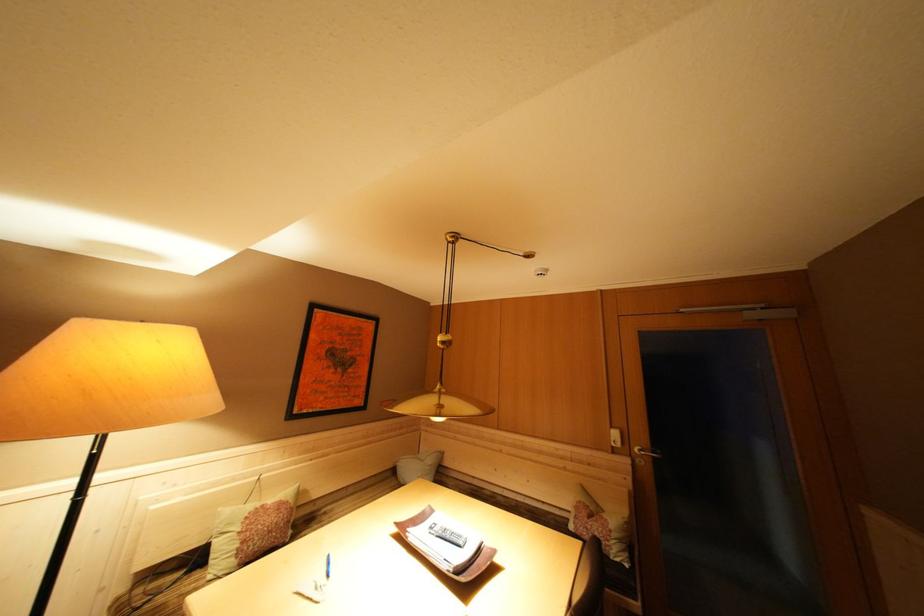
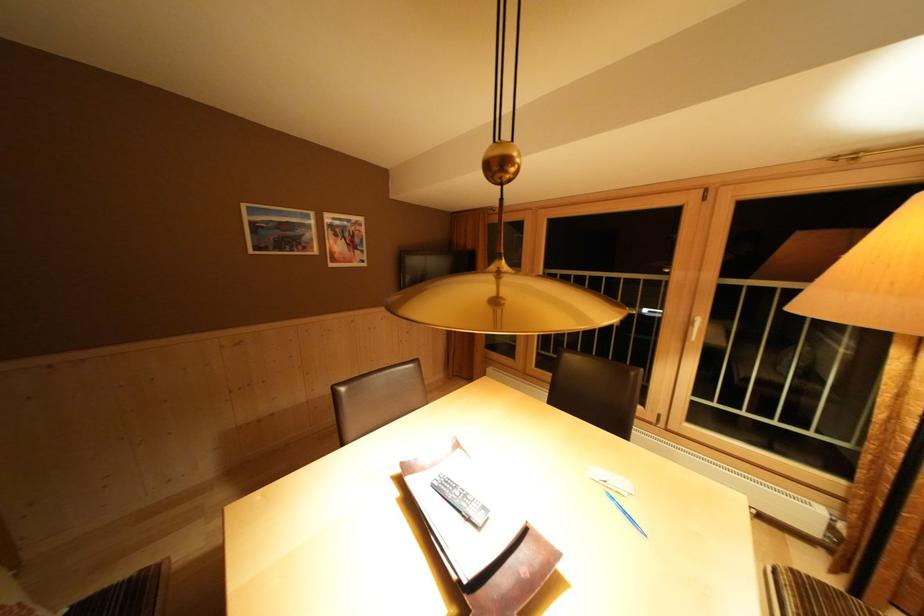
The point at (335, 569) is marked in the first image. Where is the corresponding point in the second image?

(633, 517)